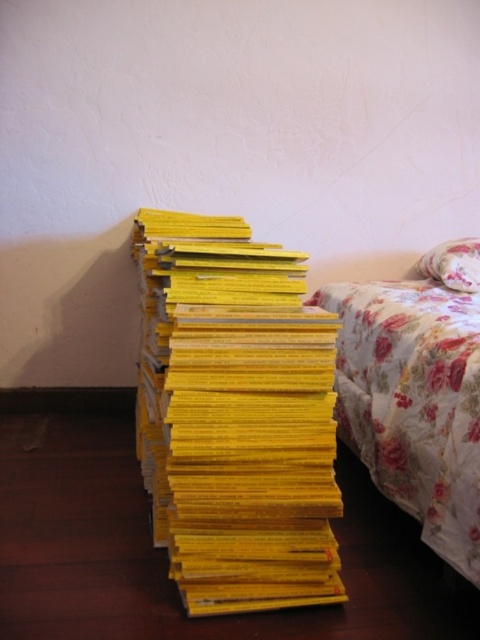
Can you confirm if yellow matte book at center is positioned above floral fabric pillow at upper right?

Actually, yellow matte book at center is below floral fabric pillow at upper right.

Which is below, yellow matte book at center or floral fabric pillow at upper right?

yellow matte book at center

Locate an element on the screen. Image resolution: width=480 pixels, height=640 pixels. yellow matte book at center is located at coordinates (236, 417).

Is floral fabric bed at right smaller than floral fabric pillow at upper right?

No.

Between floral fabric bed at right and floral fabric pillow at upper right, which one appears on the right side from the viewer's perspective?

floral fabric pillow at upper right is more to the right.

Does point (462, 268) come in front of point (440, 244)?

Yes, it is.

Identify the location of floral fabric bed at right. The height and width of the screenshot is (640, 480). (418, 403).

Which is above, yellow matte book at center or floral fabric bed at right?

yellow matte book at center is above.

Is yellow matte book at center above floral fabric bed at right?

Yes, yellow matte book at center is above floral fabric bed at right.

Identify the location of yellow matte book at center. (236, 417).

I want to click on yellow matte book at center, so click(x=236, y=417).